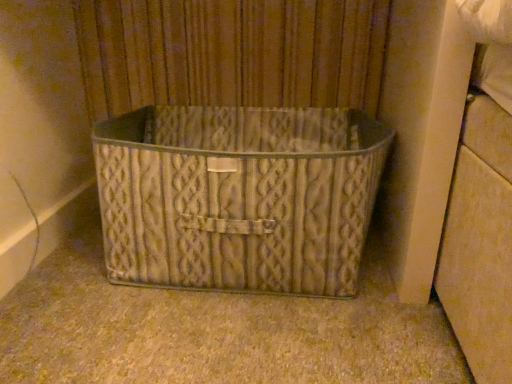
This screenshot has width=512, height=384. Find the location of `metallic textured basket at center`. metallic textured basket at center is located at coordinates (238, 196).

The image size is (512, 384). What do you see at coordinates (238, 196) in the screenshot?
I see `metallic textured basket at center` at bounding box center [238, 196].

Where is `metallic textured basket at center`? metallic textured basket at center is located at coordinates (238, 196).